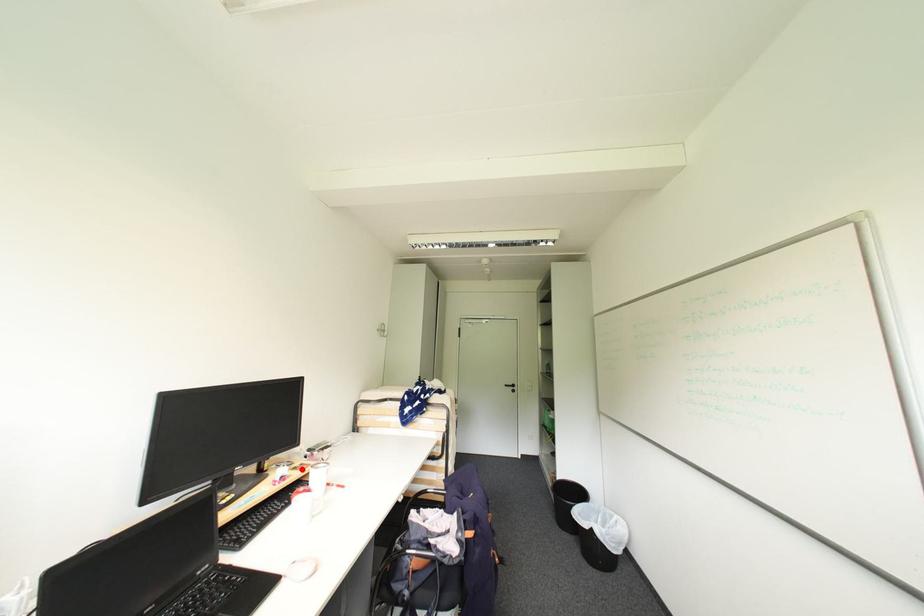
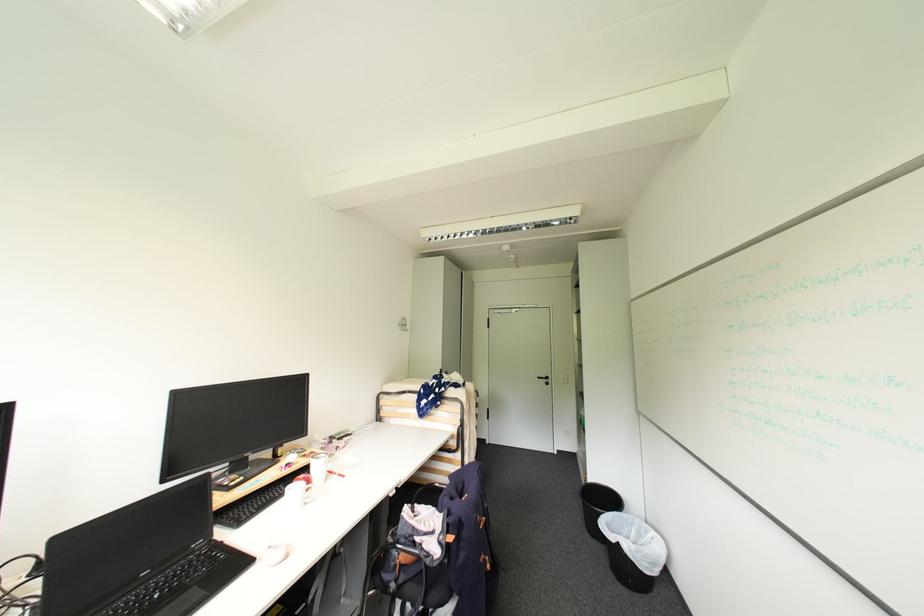
In the second image, find the point that corresponds to the highlighted location in the first image.

(311, 456)